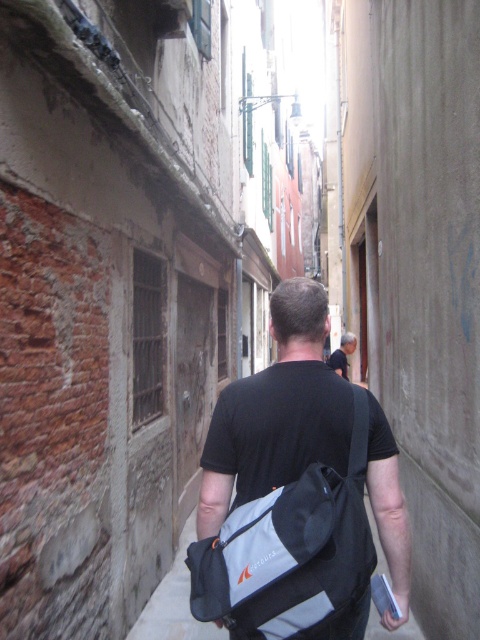
Does point (178, 576) lie behind point (355, 339)?

No.

Is gray fabric bag at center shorter than dark gray shirt at center?

Correct, gray fabric bag at center is not as tall as dark gray shirt at center.

Between point (396, 637) and point (331, 358), which one is positioned behind?

Point (331, 358)

Locate an element on the screen. The height and width of the screenshot is (640, 480). gray fabric bag at center is located at coordinates (173, 602).

Is point (283, 337) farther from camera compared to point (388, 634)?

No, it is in front of (388, 634).

Locate an element on the screen. black fabric bag at center is located at coordinates (254, 385).

Who is more distant from viewer, (314, 314) or (227, 636)?

Positioned behind is point (227, 636).

I want to click on black fabric bag at center, so click(x=254, y=385).

Which is more to the right, black fabric bag at center or dark gray shirt at center?

dark gray shirt at center

Describe the element at coordinates (254, 385) in the screenshot. I see `black fabric bag at center` at that location.

Where is `black fabric bag at center`? black fabric bag at center is located at coordinates (254, 385).